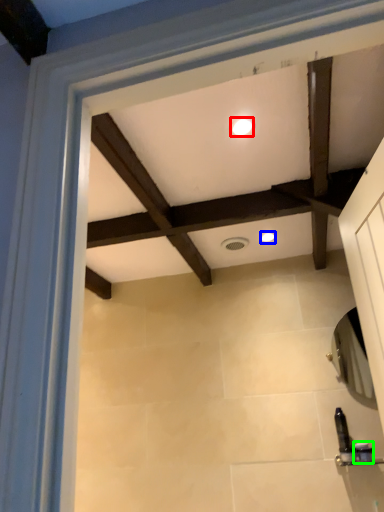
Question: Estimate the real-world distances between objects in this image. Which object is farther from lighting (highlighted by a red box), lighting (highlighted by a blue box) or toiletry (highlighted by a green box)?

Choices:
 (A) lighting
 (B) toiletry

Answer: (B)